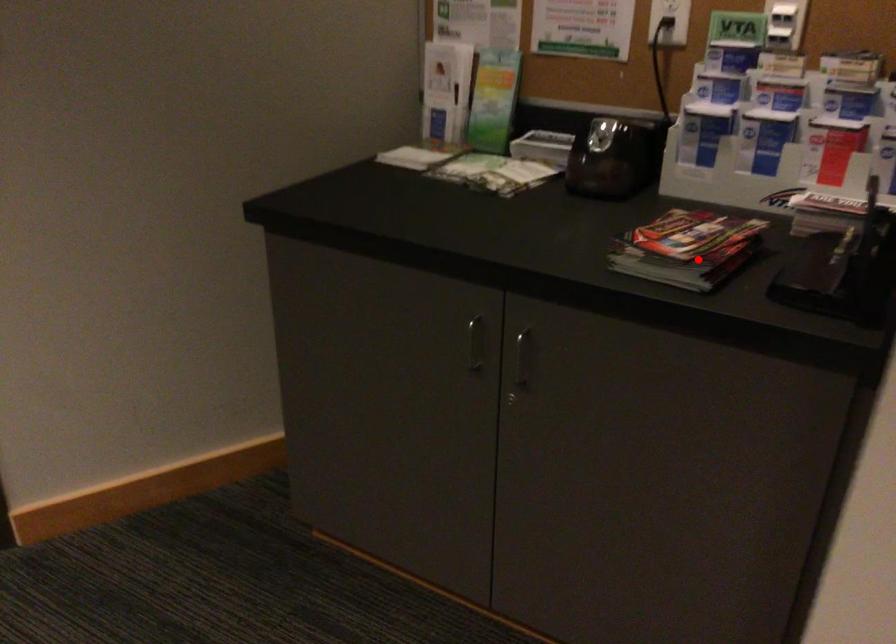
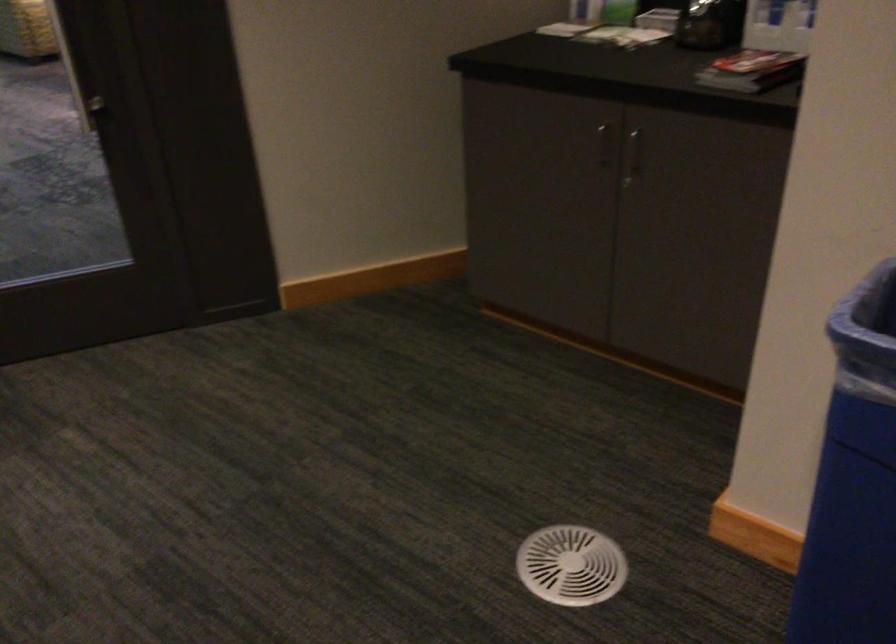
Question: I am providing you with two images of the same scene from different viewpoints. A red point is shown in image1. For the corresponding object point in image2, is it positioned nearer or farther from the camera?

Choices:
 (A) Nearer
 (B) Farther

Answer: (B)